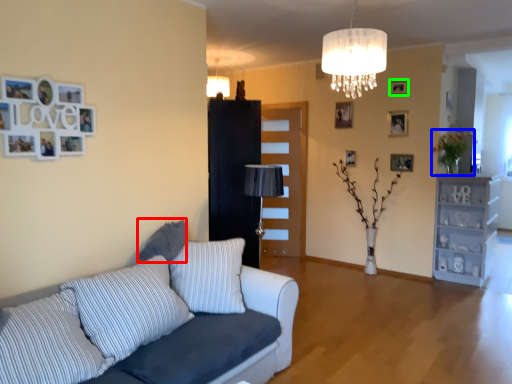
Question: Which object is the closest to the pillow (highlighted by a red box)? Choose among these: plant (highlighted by a blue box) or picture frame (highlighted by a green box).

Choices:
 (A) plant
 (B) picture frame

Answer: (B)